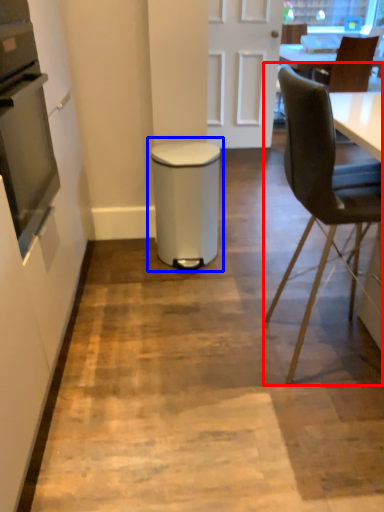
Question: Among these objects, which one is farthest to the camera, chair (highlighted by a red box) or waste container (highlighted by a blue box)?

Choices:
 (A) chair
 (B) waste container

Answer: (B)